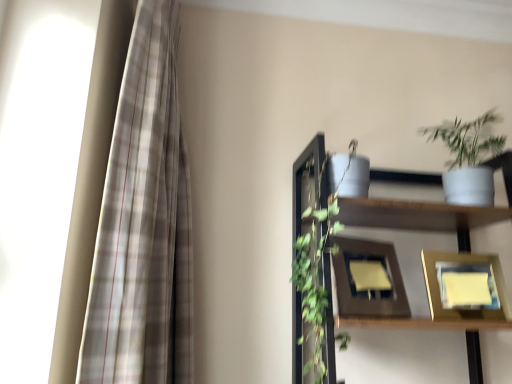
Question: Is white matte shelf at upper right positioned before plaid fabric curtain at left?

Choices:
 (A) no
 (B) yes

Answer: (A)

Question: From a real-world perspective, is white matte shelf at upper right beneath plaid fabric curtain at left?

Choices:
 (A) yes
 (B) no

Answer: (A)

Question: From the image's perspective, is white matte shelf at upper right under plaid fabric curtain at left?

Choices:
 (A) no
 (B) yes

Answer: (B)

Question: Does white matte shelf at upper right have a smaller size compared to plaid fabric curtain at left?

Choices:
 (A) no
 (B) yes

Answer: (A)

Question: Could plaid fabric curtain at left be considered to be inside white matte shelf at upper right?

Choices:
 (A) no
 (B) yes

Answer: (A)

Question: Can you confirm if white matte shelf at upper right is positioned to the left of plaid fabric curtain at left?

Choices:
 (A) no
 (B) yes

Answer: (A)

Question: Considering the relative positions of wooden picture frame at center, positioned as the second picture frame in right-to-left order, and white matte pot at upper right in the image provided, is wooden picture frame at center, positioned as the second picture frame in right-to-left order, to the left of white matte pot at upper right from the viewer's perspective?

Choices:
 (A) no
 (B) yes

Answer: (B)

Question: From the image's perspective, does wooden picture frame at center, positioned as the second picture frame in right-to-left order, appear higher than white matte pot at upper right?

Choices:
 (A) no
 (B) yes

Answer: (A)

Question: Is the depth of wooden picture frame at center, positioned as the second picture frame in right-to-left order, greater than that of white matte pot at upper right?

Choices:
 (A) no
 (B) yes

Answer: (A)

Question: Is wooden picture frame at center, the first picture frame when ordered from left to right, shorter than white matte pot at upper right?

Choices:
 (A) yes
 (B) no

Answer: (A)

Question: Considering the relative sizes of wooden picture frame at center, the first picture frame when ordered from left to right, and white matte pot at upper right in the image provided, is wooden picture frame at center, the first picture frame when ordered from left to right, wider than white matte pot at upper right?

Choices:
 (A) no
 (B) yes

Answer: (A)

Question: Considering the relative sizes of wooden picture frame at center, the first picture frame when ordered from left to right, and white matte pot at upper right in the image provided, is wooden picture frame at center, the first picture frame when ordered from left to right, smaller than white matte pot at upper right?

Choices:
 (A) yes
 (B) no

Answer: (A)

Question: From the image's perspective, is white matte pot at upper right on top of plaid fabric curtain at left?

Choices:
 (A) no
 (B) yes

Answer: (B)